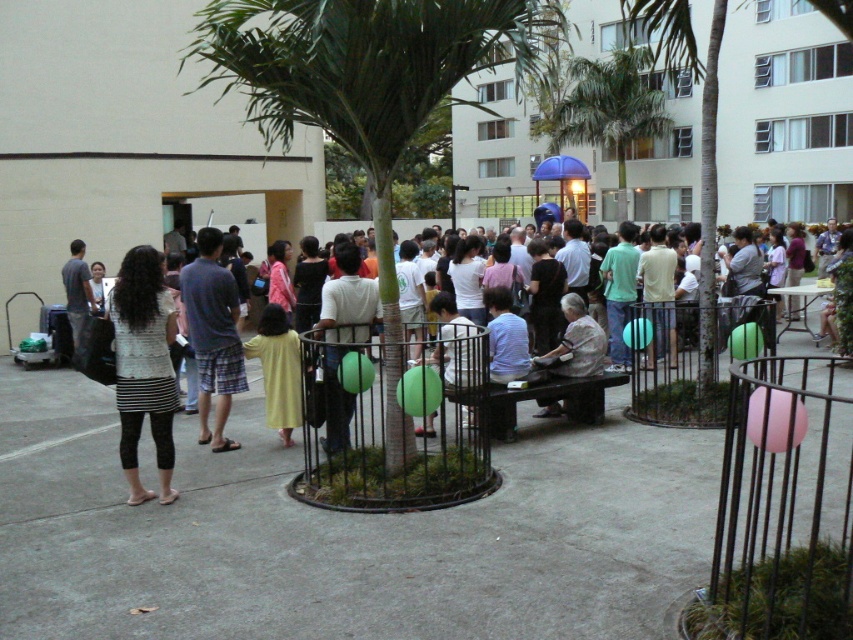
Question: Is striped fabric shirt at left in front of light brown fabric shirt at center?

Choices:
 (A) no
 (B) yes

Answer: (B)

Question: Does yellow fabric dress at center appear over matte gray shirt at center?

Choices:
 (A) no
 (B) yes

Answer: (A)

Question: Estimate the real-world distances between objects in this image. Which object is farther from the white cotton shirt at center?

Choices:
 (A) green leafy palm tree at center
 (B) light brown fabric shirt at center
 (C) plaid shorts at center
 (D) matte gray shirt at center

Answer: (A)

Question: Which object appears farthest from the camera in this image?

Choices:
 (A) plaid shorts at center
 (B) matte gray shirt at center

Answer: (B)

Question: Is white cotton shirt at center smaller than matte gray shirt at center?

Choices:
 (A) yes
 (B) no

Answer: (B)

Question: Which object appears farthest from the camera in this image?

Choices:
 (A) light brown fabric shirt at center
 (B) yellow matte dress at center
 (C) matte gray shirt at center
 (D) green leafy palm tree at center

Answer: (D)